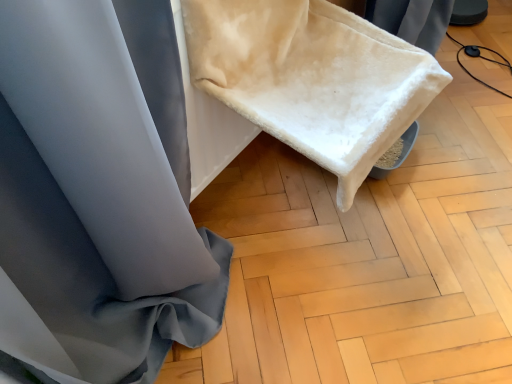
Question: Based on their sizes in the image, would you say white fluffy blanket at upper center is bigger or smaller than white soft fabric at lower right?

Choices:
 (A) small
 (B) big

Answer: (B)

Question: Is white fluffy blanket at upper center in front of or behind white soft fabric at lower right in the image?

Choices:
 (A) front
 (B) behind

Answer: (A)

Question: Is point (315, 86) positioned closer to the camera than point (489, 182)?

Choices:
 (A) closer
 (B) farther

Answer: (A)

Question: Considering the positions of white soft fabric at lower right and white fluffy blanket at upper center in the image, is white soft fabric at lower right taller or shorter than white fluffy blanket at upper center?

Choices:
 (A) short
 (B) tall

Answer: (A)

Question: From a real-world perspective, is white soft fabric at lower right physically located above or below white fluffy blanket at upper center?

Choices:
 (A) below
 (B) above

Answer: (A)

Question: Is white soft fabric at lower right bigger or smaller than white fluffy blanket at upper center?

Choices:
 (A) small
 (B) big

Answer: (A)

Question: Considering the positions of white soft fabric at lower right and white fluffy blanket at upper center in the image, is white soft fabric at lower right wider or thinner than white fluffy blanket at upper center?

Choices:
 (A) thin
 (B) wide

Answer: (B)